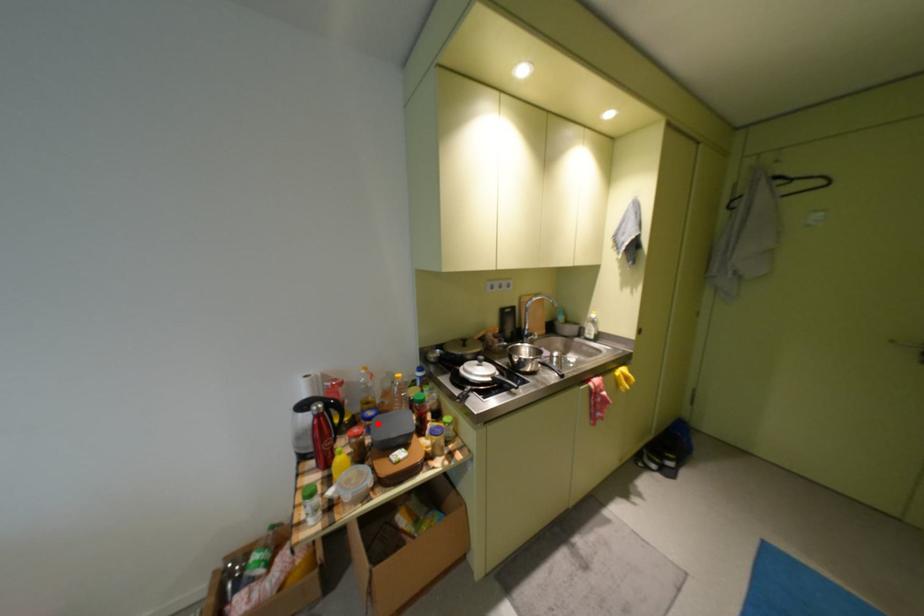
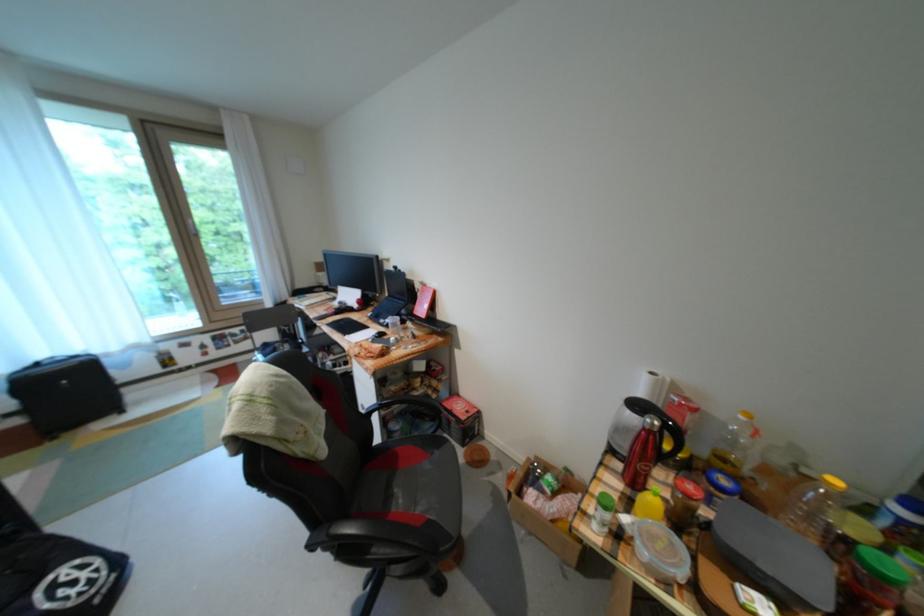
Locate, in the second image, the point that corresponds to the highlighted location in the first image.

(723, 490)